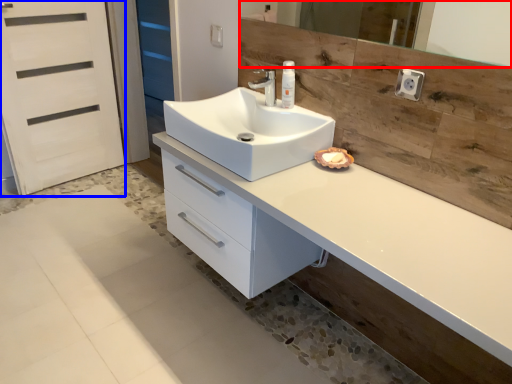
Question: Among these objects, which one is nearest to the camera, mirror (highlighted by a red box) or screen door (highlighted by a blue box)?

Choices:
 (A) mirror
 (B) screen door

Answer: (A)